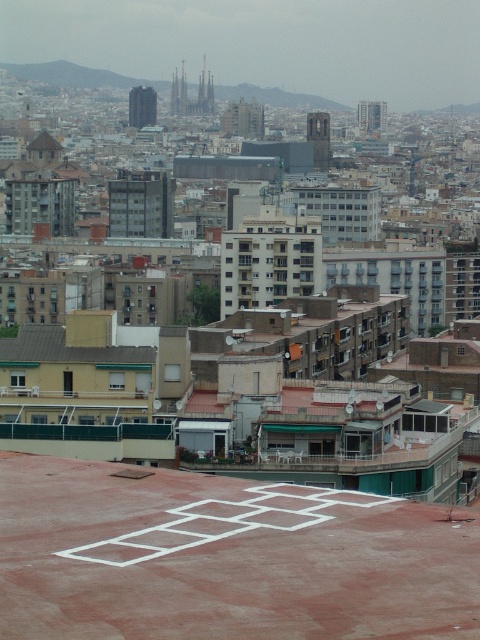
Question: Does red concrete hopscotch at center have a smaller size compared to brown corrugated metal roof at center?

Choices:
 (A) no
 (B) yes

Answer: (B)

Question: Which point appears farthest from the camera in this image?

Choices:
 (A) (104, 486)
 (B) (31, 349)

Answer: (B)

Question: Which of the following is the farthest from the observer?

Choices:
 (A) (24, 493)
 (B) (39, 356)

Answer: (B)

Question: Observing the image, what is the correct spatial positioning of red concrete hopscotch at center in reference to brown corrugated metal roof at center?

Choices:
 (A) above
 (B) below

Answer: (B)

Question: Does red concrete hopscotch at center have a smaller size compared to brown corrugated metal roof at center?

Choices:
 (A) no
 (B) yes

Answer: (B)